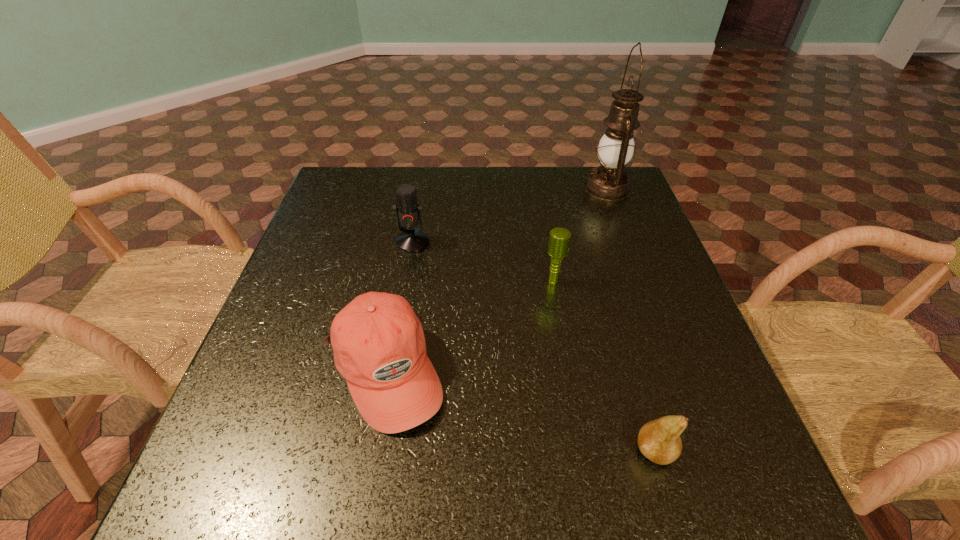
Locate an element on the screen. This screenshot has width=960, height=540. blank area at the far edge is located at coordinates (530, 210).

In the image, there is a desktop. Identify the location of free space at the left edge. The width and height of the screenshot is (960, 540). (323, 313).

The image size is (960, 540). In the image, there is a desktop. Identify the location of vacant space at the right edge. (641, 240).

In the image, there is a desktop. Identify the location of free space at the far left corner. click(x=356, y=169).

Where is `free space at the near right corner`? free space at the near right corner is located at coordinates (717, 507).

I want to click on vacant space in between the oil lamp and the pear, so click(631, 320).

Where is `vacant space that is in between the third farthest object and the baseball cap`? vacant space that is in between the third farthest object and the baseball cap is located at coordinates (469, 326).

Locate an element on the screen. This screenshot has height=540, width=960. blank region between the oil lamp and the pear is located at coordinates (631, 320).

Find the location of a particular element. The image size is (960, 540). free space between the fourth nearest object and the farthest object is located at coordinates (510, 215).

Where is `free space that is in between the baseball cap and the farthest object`? The image size is (960, 540). free space that is in between the baseball cap and the farthest object is located at coordinates (496, 280).